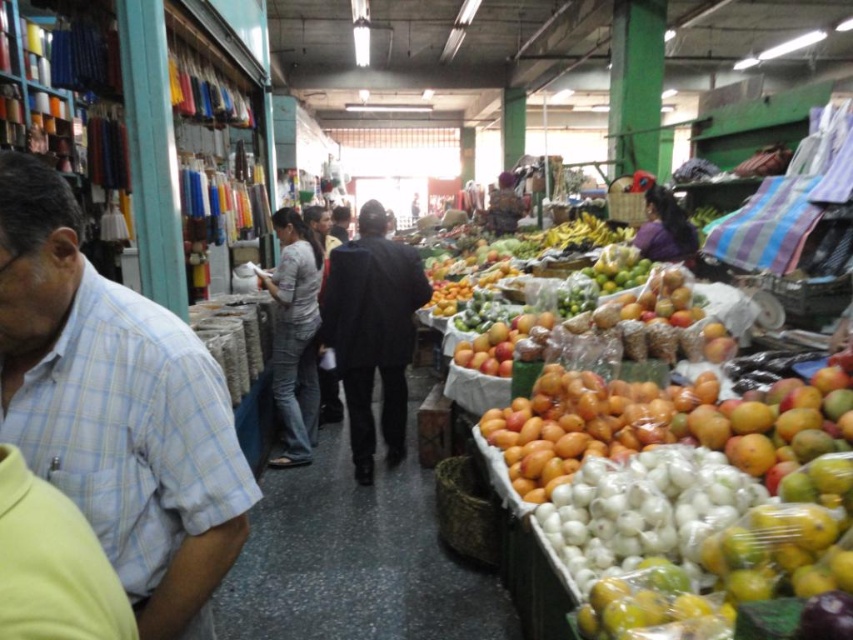
Question: Estimate the real-world distances between objects in this image. Which object is farther from the light blue plaid shirt at left?

Choices:
 (A) white translucent onion at lower right
 (B) orange matte fruit at center
 (C) mangoes at center
 (D) yellow matte mangoes at center

Answer: (C)

Question: Based on their relative distances, which object is farther from the orange matte fruit at center?

Choices:
 (A) white translucent onion at lower right
 (B) black matte suit at center
 (C) yellow matte mangoes at center
 (D) mangoes at center

Answer: (B)

Question: Which object is closer to the camera taking this photo?

Choices:
 (A) white translucent onion at lower right
 (B) mangoes at center
 (C) yellow matte mangoes at center
 (D) black matte suit at center

Answer: (A)

Question: Is black matte suit at center positioned in front of yellow matte mangoes at center?

Choices:
 (A) yes
 (B) no

Answer: (B)

Question: Does white translucent onion at lower right appear on the right side of mangoes at center?

Choices:
 (A) no
 (B) yes

Answer: (A)

Question: Does white translucent onion at lower right have a lesser width compared to mangoes at center?

Choices:
 (A) no
 (B) yes

Answer: (B)